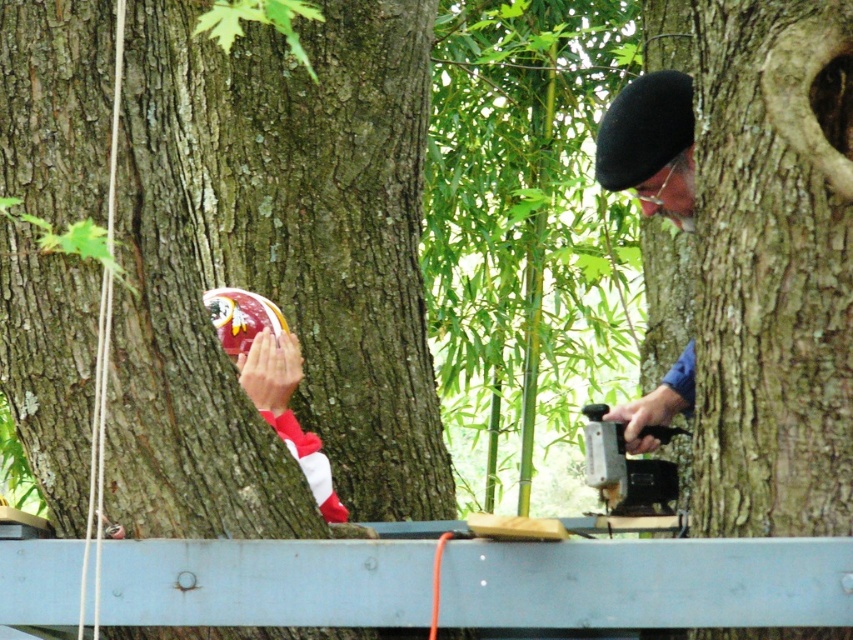
You are organizing a small office space and have a smooth gray plank at center and a metallic gray stapler at right. Which object is shorter?

The smooth gray plank at center is shorter than the metallic gray stapler at right.

You are organizing items on a desk. You have a smooth gray plank at center and a metallic gray stapler at right. Which item takes up more desk space?

The metallic gray stapler at right takes up more desk space than the smooth gray plank at center because it occupies more space according to the description.

You are trying to determine the position of two tree trunks in the image. The scene shows a person holding a football helmet behind one of them. Which of the two tree trunks, the brown rough bark at center or the rough bark tree at center, is closer to you?

The brown rough bark at center is closer to you because it is further to the viewer than the rough bark tree at center.